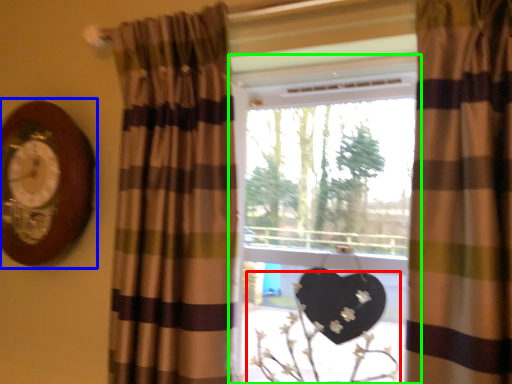
Question: Estimate the real-world distances between objects in this image. Which object is farther from floral arrangement (highlighted by a red box), clock (highlighted by a blue box) or window (highlighted by a green box)?

Choices:
 (A) clock
 (B) window

Answer: (A)